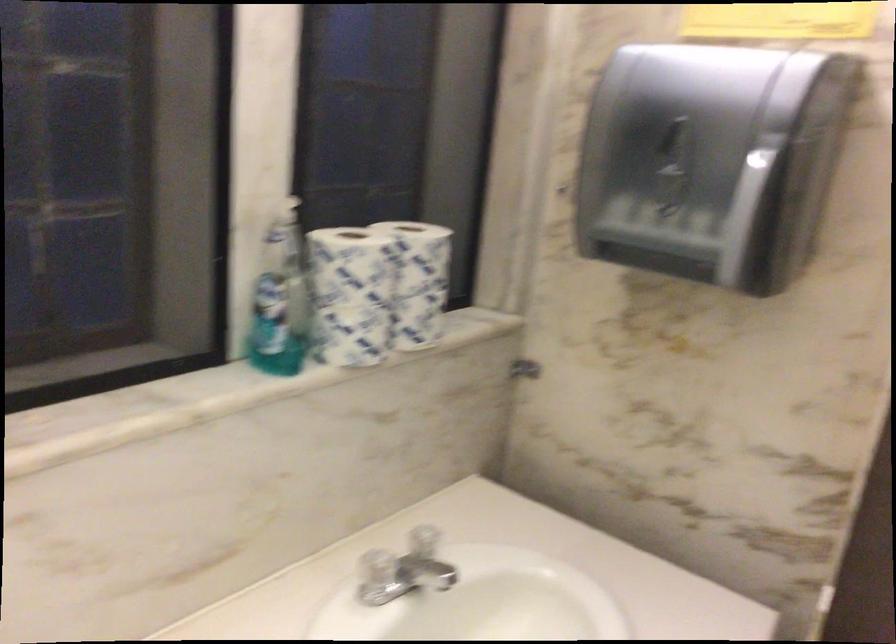
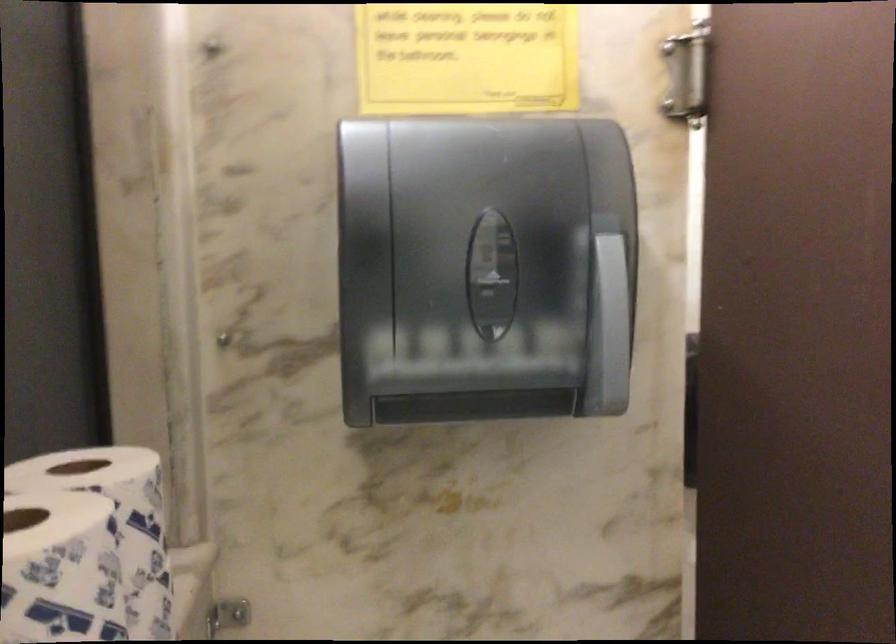
Question: The first image is from the beginning of the video and the second image is from the end. How did the camera likely rotate when shooting the video?

Choices:
 (A) Left
 (B) Right
 (C) Up
 (D) Down

Answer: (B)